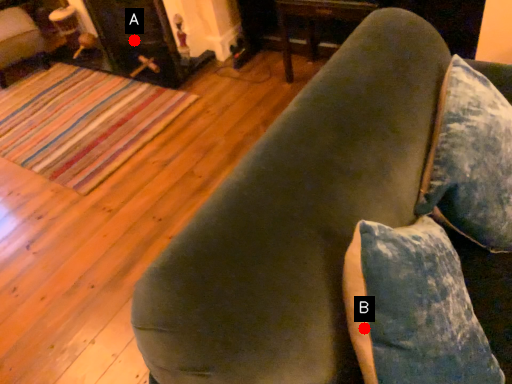
Question: Two points are circled on the image, labeled by A and B beside each circle. Which point is closer to the camera?

Choices:
 (A) A is closer
 (B) B is closer

Answer: (B)